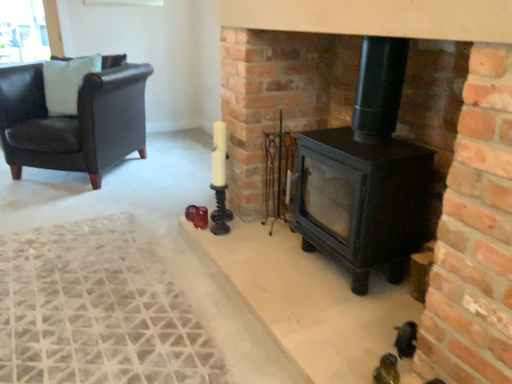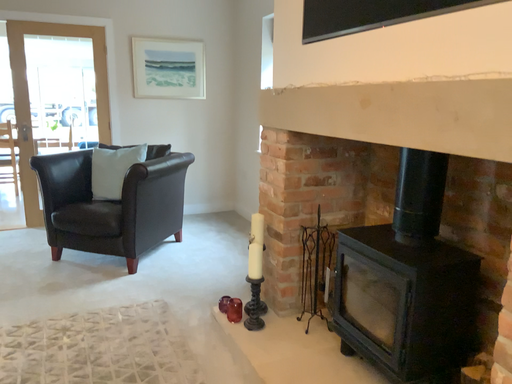
Question: How did the camera likely rotate when shooting the video?

Choices:
 (A) rotated downward
 (B) rotated upward

Answer: (B)